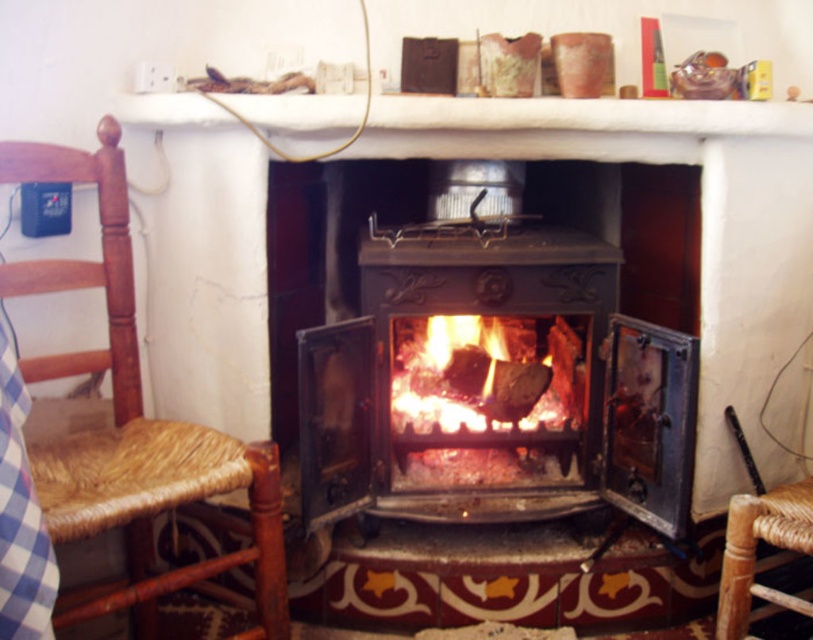
Question: Is brown wicker rocking chair at left to the left of charcoal black wood at center from the viewer's perspective?

Choices:
 (A) no
 (B) yes

Answer: (B)

Question: Which point appears closest to the camera in this image?

Choices:
 (A) (146, 625)
 (B) (438, 266)

Answer: (A)

Question: Does shiny black stove at center appear on the left side of brown wicker rocking chair at left?

Choices:
 (A) yes
 (B) no

Answer: (B)

Question: Among these points, which one is farthest from the camera?

Choices:
 (A) (507, 333)
 (B) (533, 397)
 (C) (102, 195)

Answer: (A)

Question: Which object appears closest to the camera in this image?

Choices:
 (A) brown wicker rocking chair at left
 (B) shiny black stove at center
 (C) charcoal black wood at center

Answer: (A)

Question: Can you confirm if brown wicker rocking chair at left is positioned above charcoal black wood at center?

Choices:
 (A) yes
 (B) no

Answer: (A)